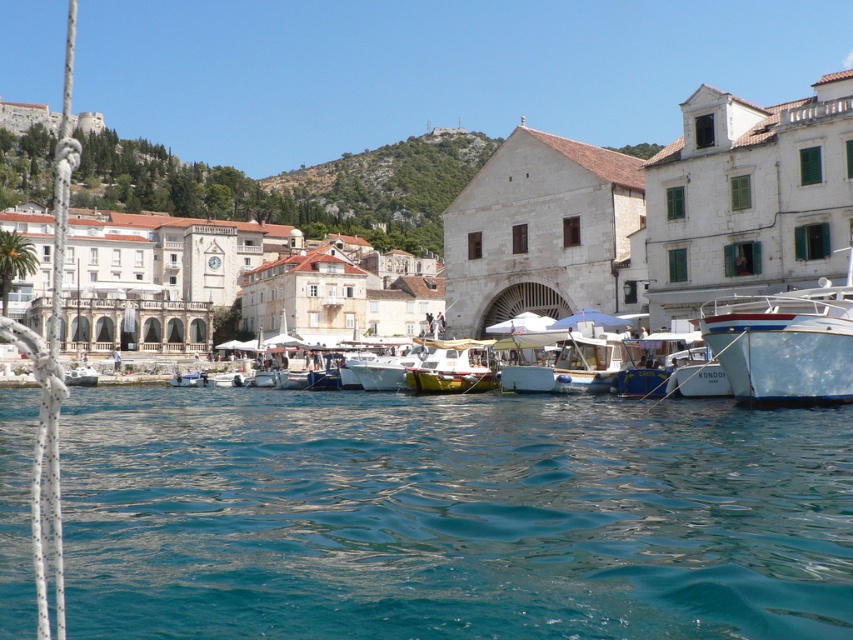
Question: Estimate the real-world distances between objects in this image. Which object is closer to the clear blue water at center?

Choices:
 (A) yellow matte boat at center
 (B) white stone building at center
 (C) white glossy boat at right

Answer: (C)

Question: Is clear blue water at center further to camera compared to white stone building at center?

Choices:
 (A) yes
 (B) no

Answer: (B)

Question: Which point is closer to the camera?

Choices:
 (A) clear blue water at center
 (B) yellow matte boat at center
 (C) white stone building at center

Answer: (A)

Question: Can you confirm if white stone building at center is positioned above white glossy boat at right?

Choices:
 (A) yes
 (B) no

Answer: (A)

Question: Observing the image, what is the correct spatial positioning of clear blue water at center in reference to white glossy boat at right?

Choices:
 (A) left
 (B) right

Answer: (A)

Question: Which of the following is the farthest from the observer?

Choices:
 (A) yellow matte boat at center
 (B) white stone building at center
 (C) clear blue water at center
 (D) white glossy boat at right

Answer: (A)